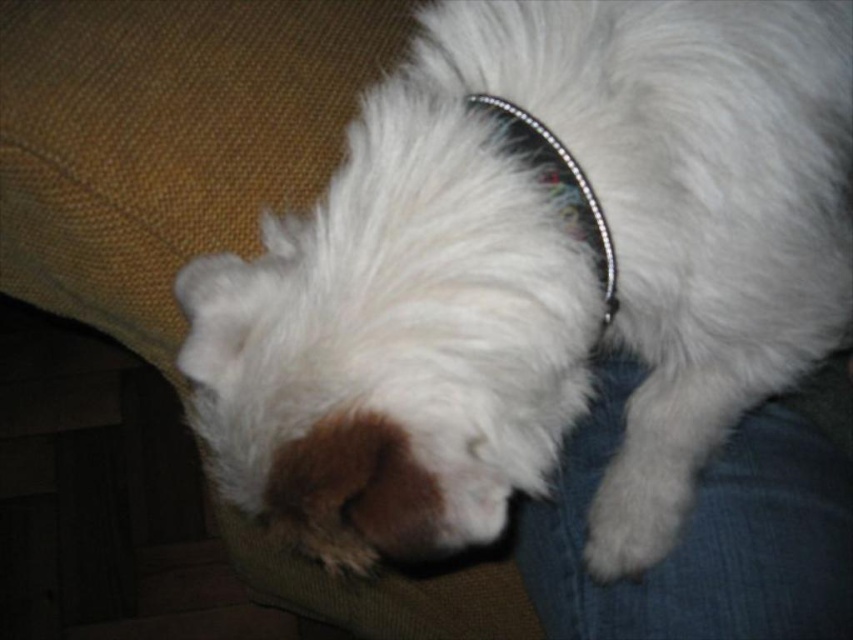
Consider the image. Does white fluffy dog at center have a larger size compared to sparkly silver dog collar at center?

Correct, white fluffy dog at center is larger in size than sparkly silver dog collar at center.

Does white fluffy dog at center have a greater width compared to sparkly silver dog collar at center?

Indeed, white fluffy dog at center has a greater width compared to sparkly silver dog collar at center.

Which is in front, point (846, 241) or point (561, 157)?

Positioned in front is point (561, 157).

Find the location of a particular element. Image resolution: width=853 pixels, height=640 pixels. white fluffy dog at center is located at coordinates (534, 275).